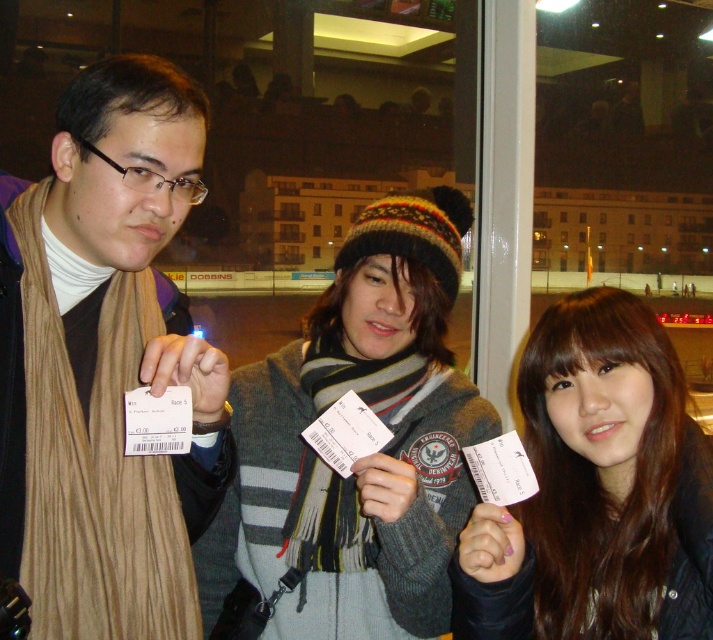
You are a photographer trying to capture a clear shot of both the brown wool scarf at left and the brown matte hair at center. Which object will appear larger in your photo?

The brown wool scarf at left will appear larger in the photo because it is closer to the viewer than the brown matte hair at center.

You are a security guard checking tickets at a venue. You notice two people holding tickets in front of you. The first person is wearing a gray knit sweater at center, and the second has brown matte hair at center. The distance between them is 9.95 inches. If your handheld scanner has a minimum required distance of 10 inches between individuals for accurate scanning, can both individuals be scanned simultaneously without moving them?

The distance between the gray knit sweater at center and brown matte hair at center is 9.95 inches, which is less than the required 10 inches. Therefore, they cannot be scanned simultaneously without moving them.

You are a security guard at a venue. You need to check the distance between the brown wool scarf at left and the brown matte hair at center to ensure they are not too close for the security cameras to capture both clearly. The minimum required distance for the cameras to capture two objects clearly is 24 inches. Can the security cameras capture both objects clearly?

The brown wool scarf at left is 23.99 inches from the brown matte hair at center. Since the minimum required distance is 24 inches, the security cameras cannot capture both objects clearly as the distance is slightly less than required.